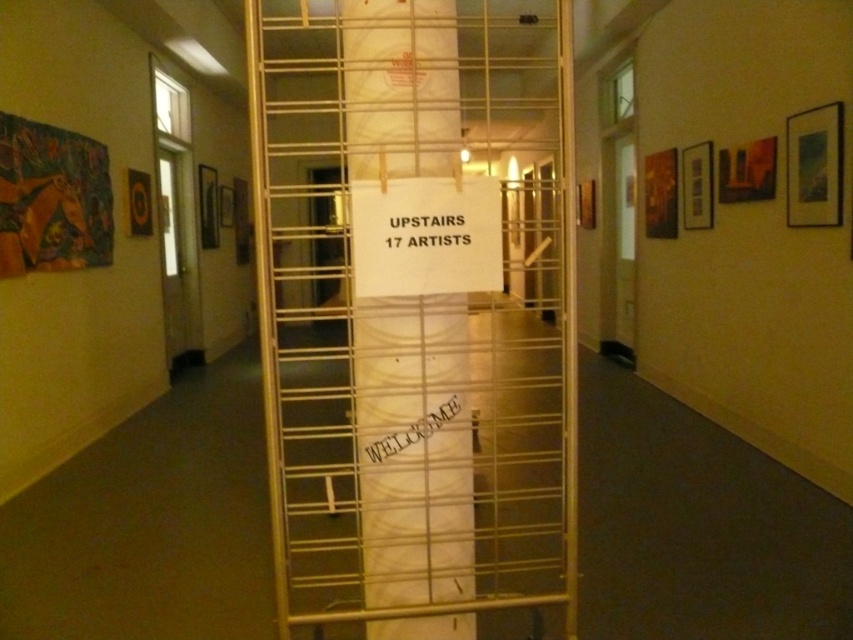
Does gold metal scaffolding at center appear on the right side of white paper at center?

No, gold metal scaffolding at center is not to the right of white paper at center.

Can you confirm if gold metal scaffolding at center is wider than white paper at center?

No.

Locate an element on the screen. The height and width of the screenshot is (640, 853). gold metal scaffolding at center is located at coordinates (416, 308).